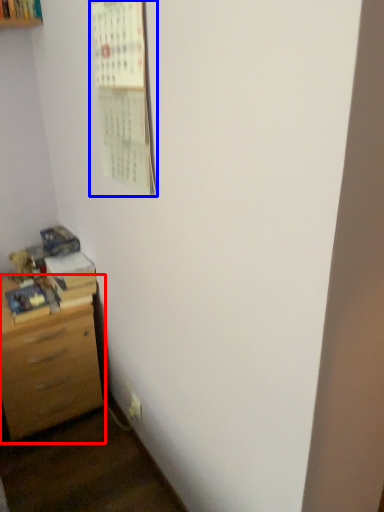
Question: Which point is further to the camera, chest of drawers (highlighted by a red box) or bulletin board (highlighted by a blue box)?

Choices:
 (A) chest of drawers
 (B) bulletin board

Answer: (A)